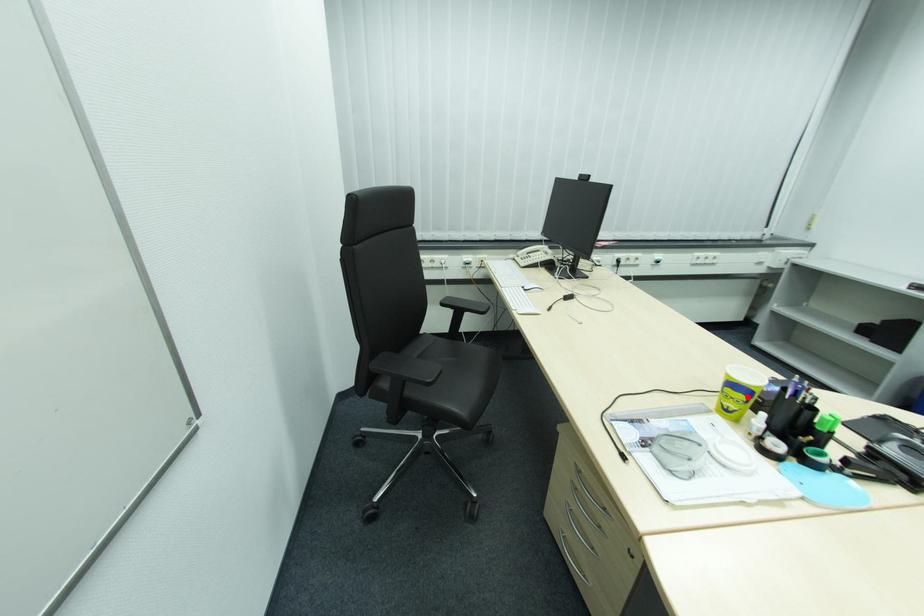
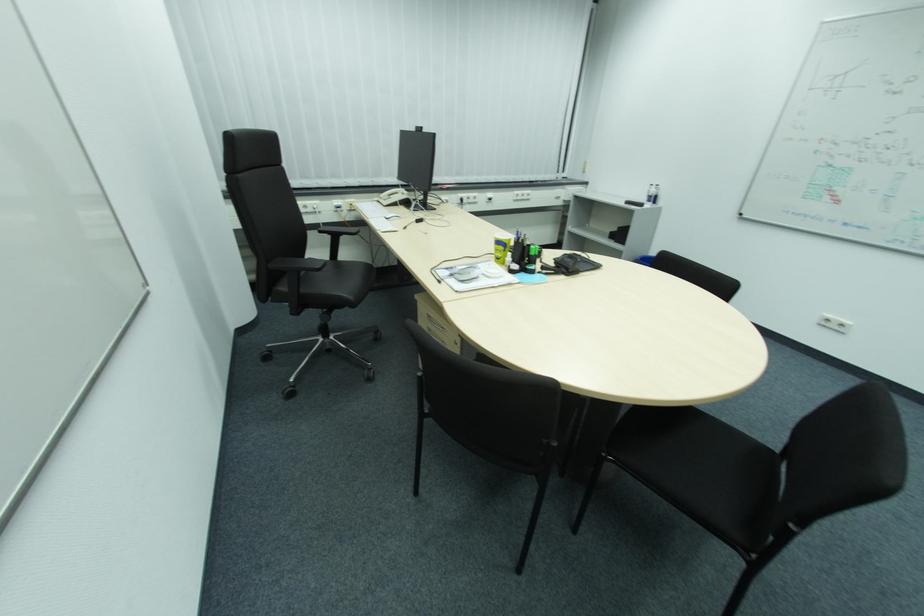
In the second image, find the point that corresponds to the highlighted location in the first image.

(507, 248)